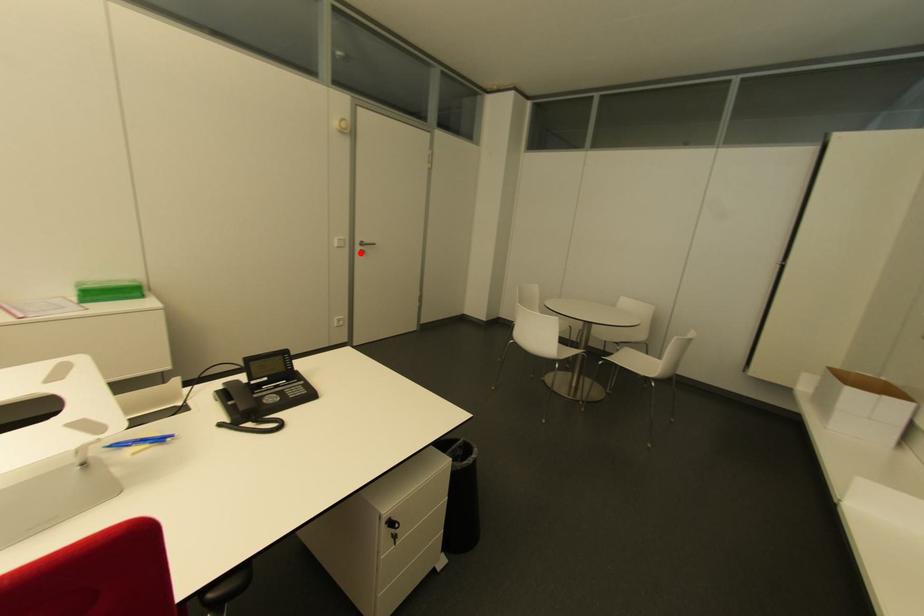
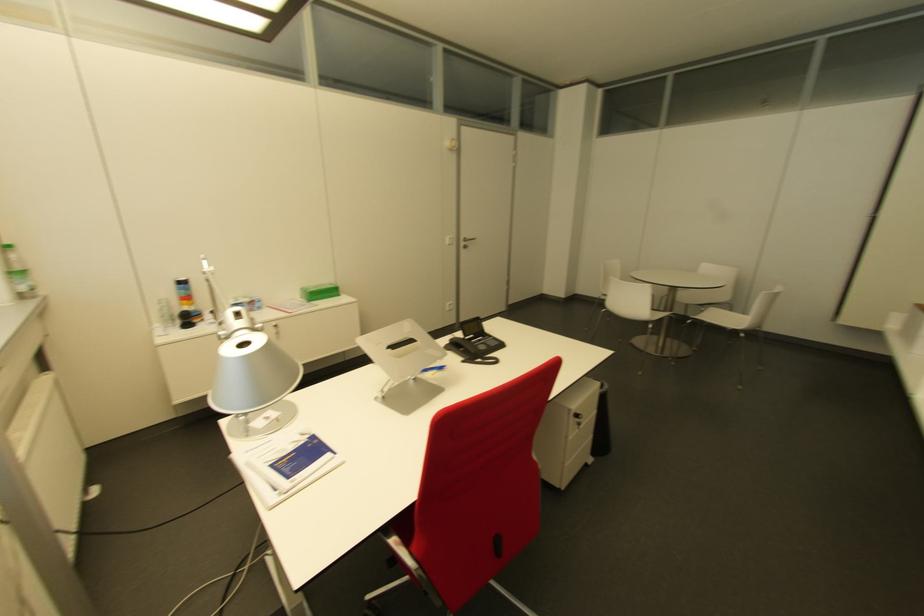
Locate, in the second image, the point that corresponds to the highlighted location in the first image.

(463, 246)